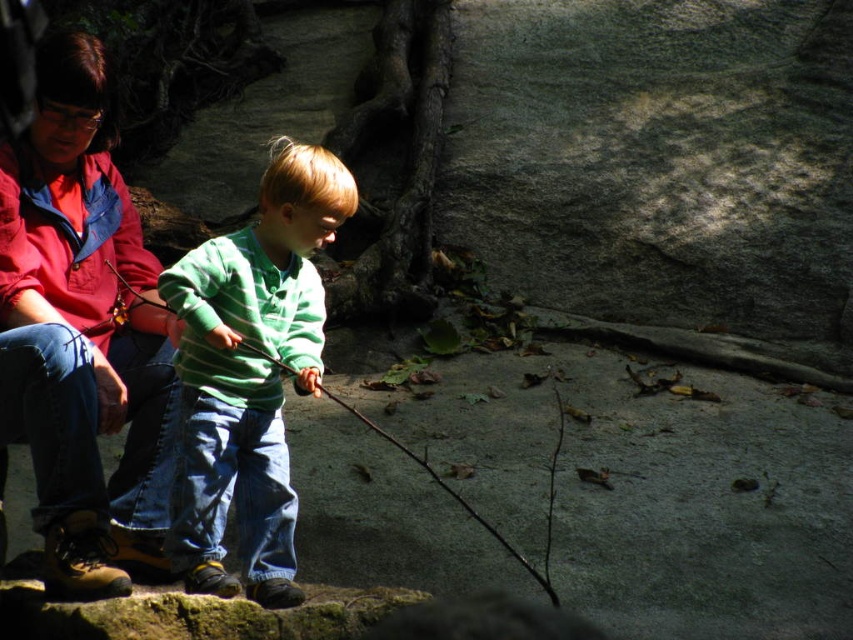
Question: Which point is closer to the camera?

Choices:
 (A) (51, 253)
 (B) (405, 452)

Answer: (A)

Question: Which point appears closest to the camera in this image?

Choices:
 (A) (73, 504)
 (B) (427, 470)

Answer: (A)

Question: Which object appears farthest from the camera in this image?

Choices:
 (A) wooden stick at center
 (B) red cotton shirt at upper left

Answer: (B)

Question: Is green striped sweater at center below wooden stick at center?

Choices:
 (A) no
 (B) yes

Answer: (A)

Question: Can you confirm if red cotton shirt at upper left is positioned to the right of green striped sweater at center?

Choices:
 (A) no
 (B) yes

Answer: (A)

Question: Can you confirm if green striped sweater at center is positioned below wooden stick at center?

Choices:
 (A) yes
 (B) no

Answer: (B)